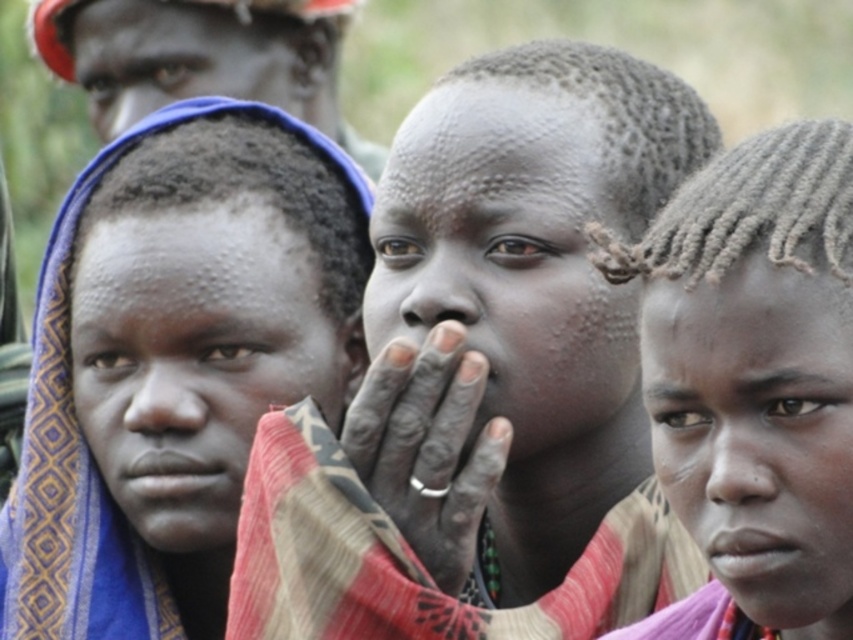
Which of these two, dark skin hair at center or matte red helmet at upper left, stands shorter?

dark skin hair at center

Between dark skin hair at center and matte red helmet at upper left, which one has more height?

With more height is matte red helmet at upper left.

What do you see at coordinates (753, 381) in the screenshot? Image resolution: width=853 pixels, height=640 pixels. I see `dark skin hair at center` at bounding box center [753, 381].

The width and height of the screenshot is (853, 640). What are the coordinates of `dark skin hair at center` in the screenshot? It's located at (753, 381).

Who is higher up, matte skin child at center or matte red helmet at upper left?

matte red helmet at upper left is above.

Does point (668, 163) lie in front of point (57, 35)?

Yes, point (668, 163) is in front of point (57, 35).

Locate an element on the screen. The width and height of the screenshot is (853, 640). matte skin child at center is located at coordinates (486, 376).

Which is more to the right, dark skin hair at center or blue woven cloth at left?

Positioned to the right is dark skin hair at center.

Is point (813, 397) behind point (4, 540)?

That is False.

Between point (641, 364) and point (39, 317), which one is positioned in front?

Point (641, 364) is in front.

Identify the location of dark skin hair at center. click(x=753, y=381).